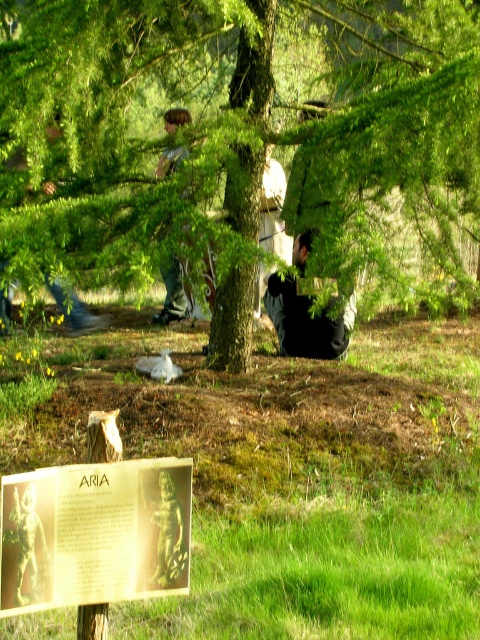
What do you see at coordinates (240, 145) in the screenshot?
I see `green leafy tree at center` at bounding box center [240, 145].

Is green leafy tree at center in front of black matte jacket at center?

Yes, it is in front of black matte jacket at center.

Find the location of a particular element. green leafy tree at center is located at coordinates (240, 145).

The image size is (480, 640). Identify the location of bronze statue at lower center. (168, 531).

Does bronze statue at lower center lie in front of brown hair at upper center?

That is True.

Is point (175, 524) positioned before point (159, 316)?

Yes.

You are a GUI agent. You are given a task and a screenshot of the screen. Output one action in this format:
    pyautogui.click(x=<x>, y=<y>)
    Task: Click on the bronze statue at lower center
    
    Given the screenshot: What is the action you would take?
    pyautogui.click(x=168, y=531)

Is the position of green leafy tree at center more distant than that of gold-bronze plaque at lower center?

Yes, it is behind gold-bronze plaque at lower center.

Is green leafy tree at center to the left of gold-bronze plaque at lower center from the viewer's perspective?

In fact, green leafy tree at center is to the right of gold-bronze plaque at lower center.

Between point (463, 44) and point (100, 586), which one is positioned behind?

Positioned behind is point (463, 44).

You are a GUI agent. You are given a task and a screenshot of the screen. Output one action in this format:
    pyautogui.click(x=<x>, y=<y>)
    Task: Click on the green leafy tree at center
    
    Given the screenshot: What is the action you would take?
    pyautogui.click(x=240, y=145)